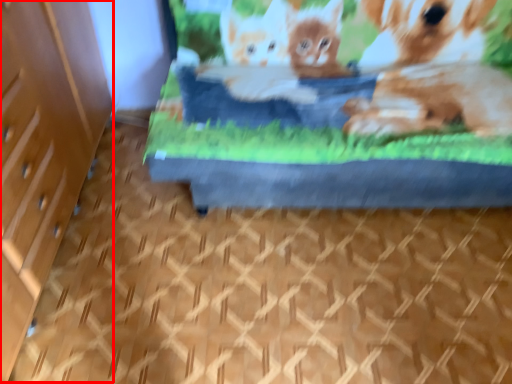
Question: From the image's perspective, where is file cabinet (annotated by the red box) located in relation to bed in the image?

Choices:
 (A) below
 (B) above

Answer: (A)